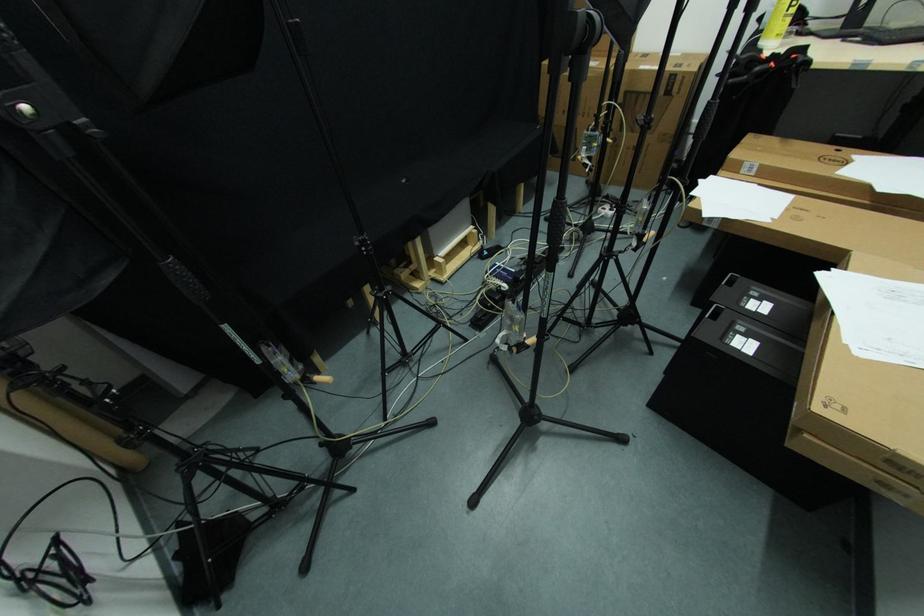
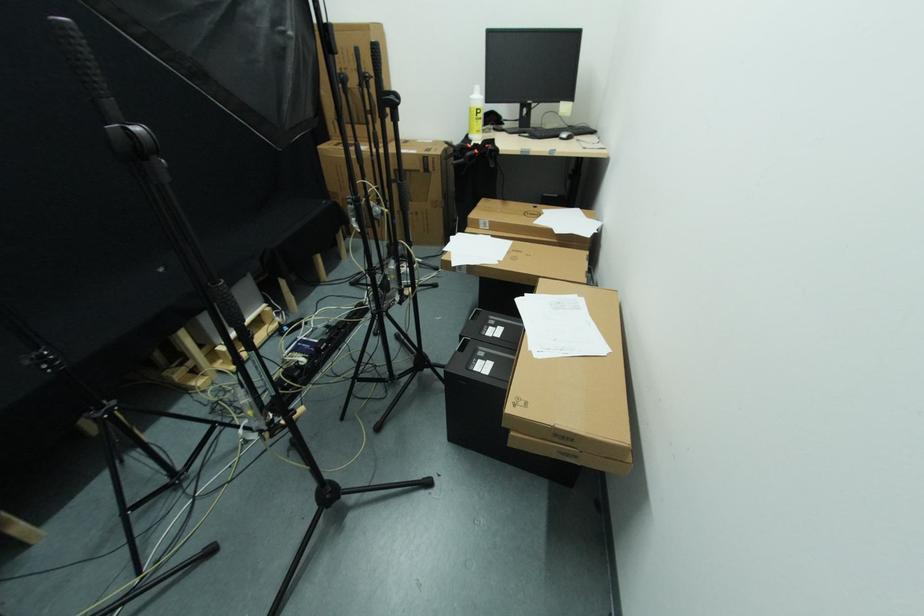
Find the pixel in the second image that matches (848,413) in the first image.

(528, 406)